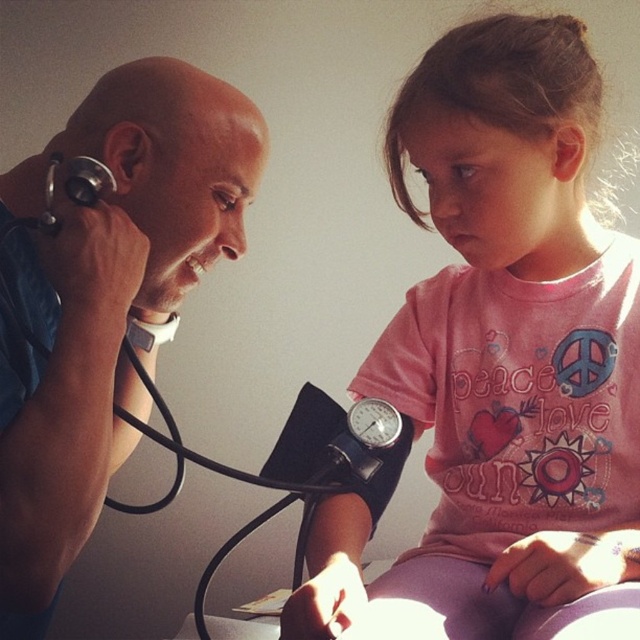
Is point (486, 380) positioned in front of point (17, 561)?

No, (486, 380) is behind (17, 561).

Does pink fabric shirt at upper right come in front of blue fabric stethoscope at left?

That is False.

Who is more distant from viewer, [454,636] or [106,348]?

Positioned behind is point [454,636].

At what (x,y) coordinates should I click in order to perform the action: click on pink fabric shirt at upper right. Please return your answer as a coordinate pair (x, y). Looking at the image, I should click on (500, 364).